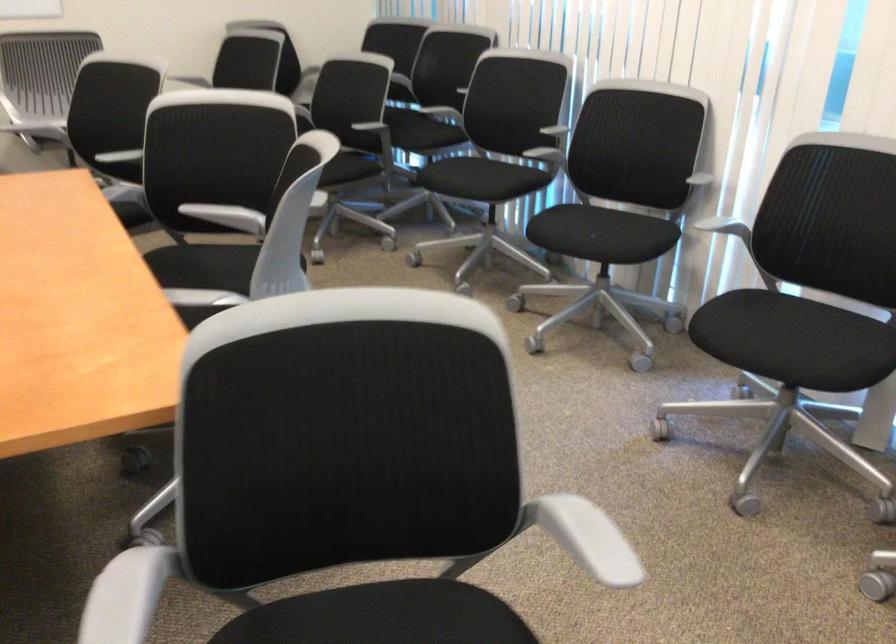
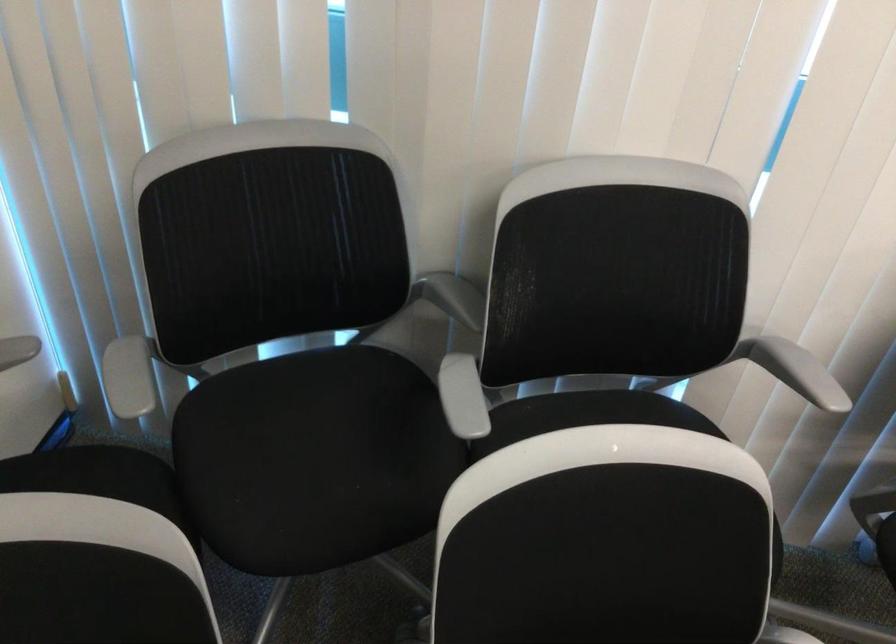
Locate, in the second image, the point that corresponds to point 431,67 in the first image.

(453, 297)